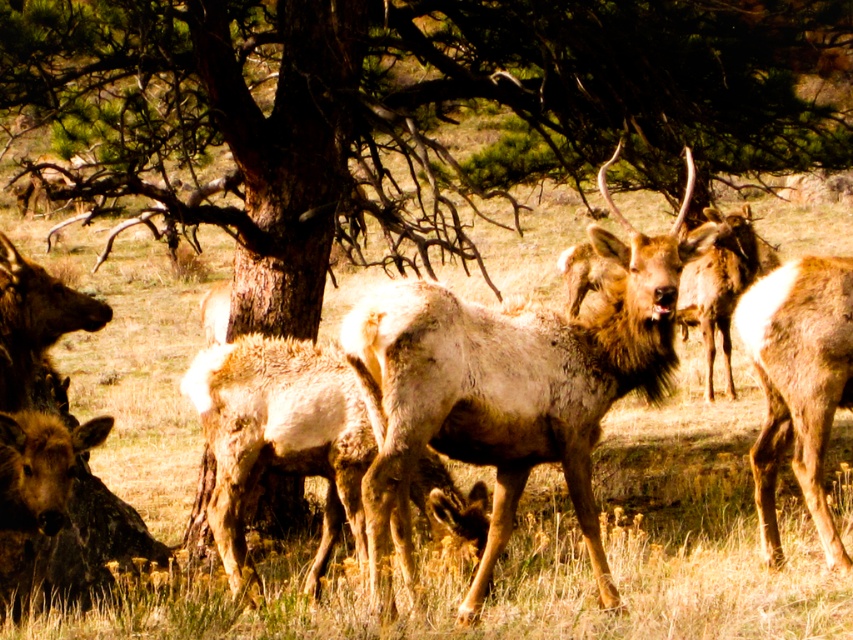
You are a wildlife photographer carrying a camera bag that is 1.2 meters wide. You want to position yourself between the dry grass at lower left and the brown fur coat at right to capture both in your shot. Can your camera bag fit in the space between them?

The distance between the dry grass at lower left and the brown fur coat at right is 1.36 meters. Since your camera bag is 1.2 meters wide, it can fit within the space between them as the available space is wider than the bag.